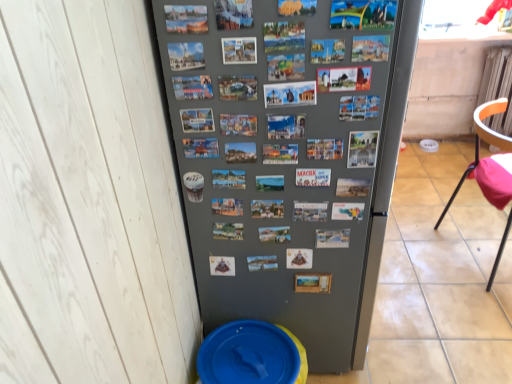
In order to click on vacant space behind orange plastic chair at right in this screenshot , I will do `click(446, 204)`.